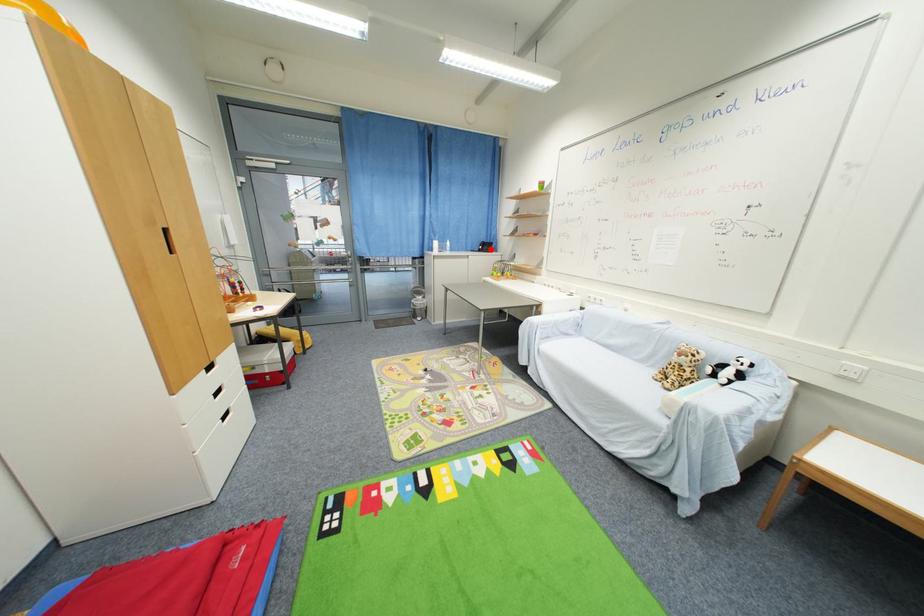
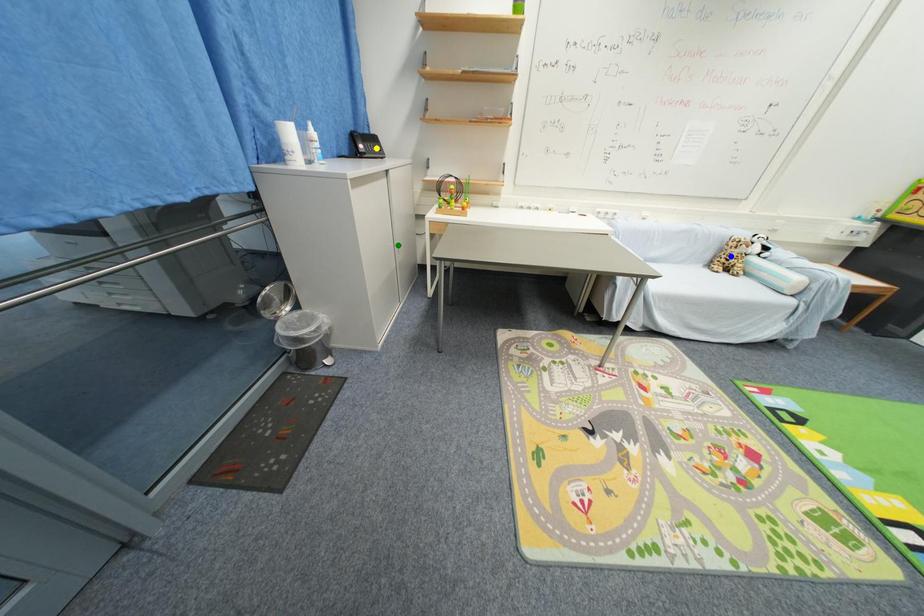
Question: I am providing you with two images of the same scene from different viewpoints. A red point is marked on the first image. You are given multiple points on the second image. Which spot in image 2 lines up with the point in image 1?

Choices:
 (A) yellow point
 (B) green point
 (C) blue point

Answer: (A)